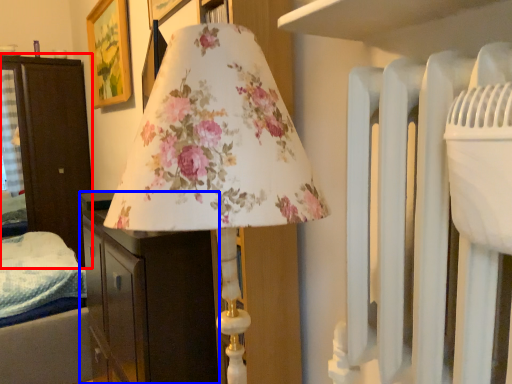
Question: Which point is further to the camera, furniture (highlighted by a red box) or furniture (highlighted by a blue box)?

Choices:
 (A) furniture
 (B) furniture

Answer: (A)